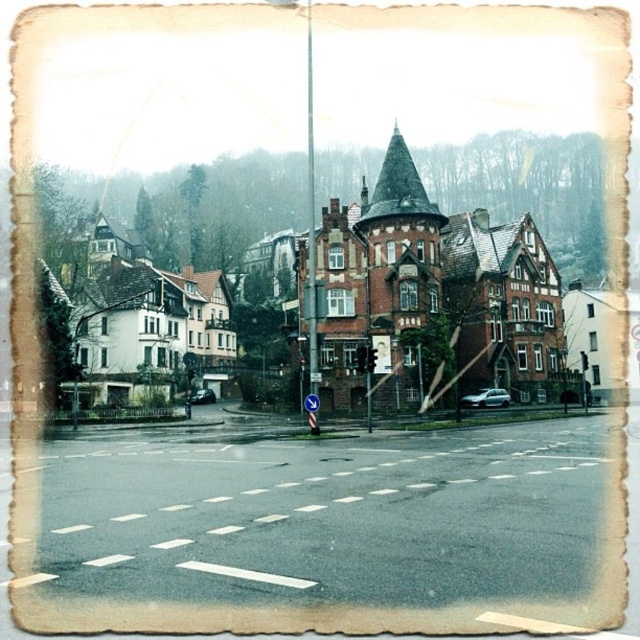
Question: Which point is farther from the camera taking this photo?

Choices:
 (A) (93, 524)
 (B) (61, 182)

Answer: (B)

Question: Is red brick building at center thinner than white asphalt at center?

Choices:
 (A) yes
 (B) no

Answer: (B)

Question: Which object appears farthest from the camera in this image?

Choices:
 (A) red brick building at center
 (B) white asphalt at center

Answer: (A)

Question: Which point is farther from the camera taking this photo?

Choices:
 (A) (108, 332)
 (B) (452, 547)

Answer: (A)

Question: Can you confirm if red brick building at center is smaller than white asphalt at center?

Choices:
 (A) no
 (B) yes

Answer: (A)

Question: Is red brick building at center smaller than white asphalt at center?

Choices:
 (A) no
 (B) yes

Answer: (A)